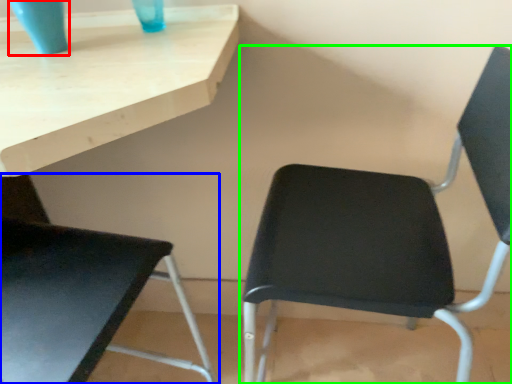
Question: Which is farther away from glass vase (highlighted by a red box)? chair (highlighted by a blue box) or chair (highlighted by a green box)?

Choices:
 (A) chair
 (B) chair

Answer: (B)